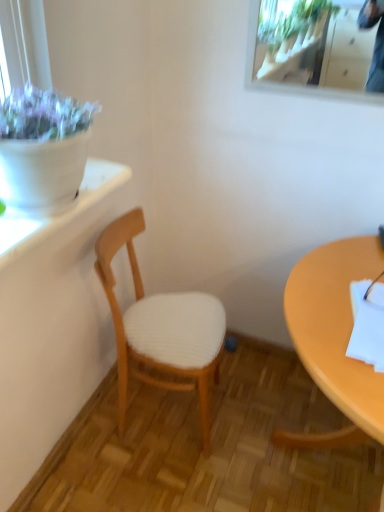
Question: Is clear glass mirror at upper right taller or shorter than matte yellow desk at right?

Choices:
 (A) short
 (B) tall

Answer: (A)

Question: Do you think clear glass mirror at upper right is within matte yellow desk at right, or outside of it?

Choices:
 (A) outside
 (B) inside

Answer: (A)

Question: Estimate the real-world distances between objects in this image. Which object is closer to the matte yellow desk at right?

Choices:
 (A) wooden chair at center
 (B) clear glass mirror at upper right

Answer: (A)

Question: Which object is positioned closest to the wooden chair at center?

Choices:
 (A) clear glass mirror at upper right
 (B) matte yellow desk at right

Answer: (B)